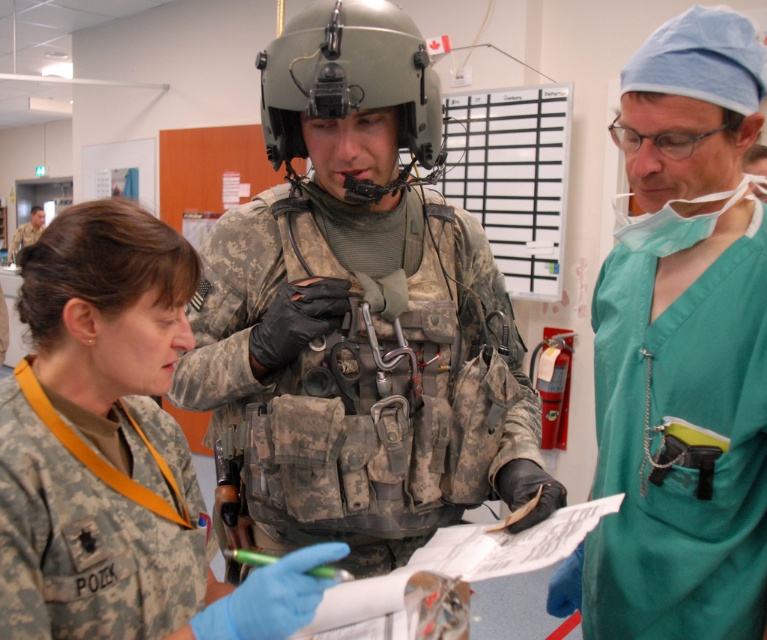
Question: Among these objects, which one is farthest from the camera?

Choices:
 (A) green scrubs at right
 (B) matte gray helmet at center

Answer: (B)

Question: Does green scrubs at right appear over matte gray helmet at center?

Choices:
 (A) yes
 (B) no

Answer: (B)

Question: Which of the following is the closest to the observer?

Choices:
 (A) camouflage uniform at center
 (B) matte gray helmet at center
 (C) green scrubs at right

Answer: (A)

Question: Is green scrubs at right bigger than camouflage uniform at center?

Choices:
 (A) no
 (B) yes

Answer: (B)

Question: Which point is closer to the camera taking this photo?

Choices:
 (A) (604, 419)
 (B) (354, 193)

Answer: (B)

Question: Observing the image, what is the correct spatial positioning of camouflage uniform at center in reference to matte gray helmet at center?

Choices:
 (A) left
 (B) right

Answer: (A)